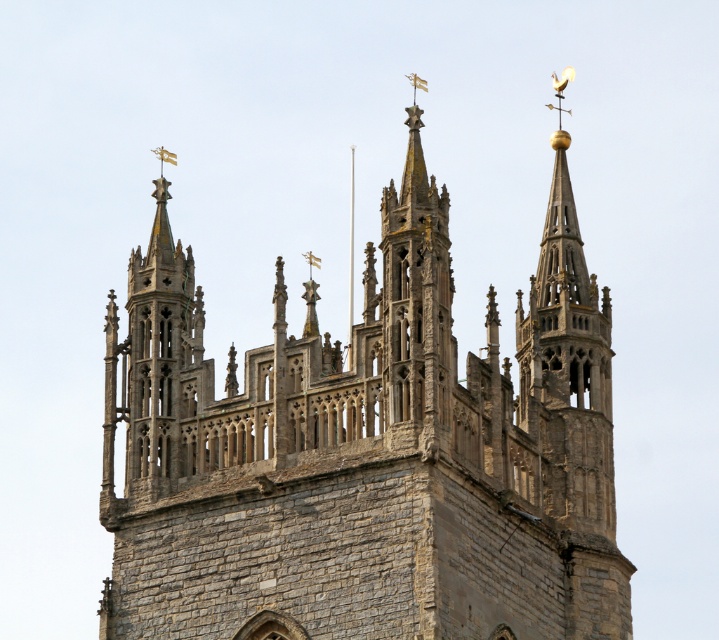
Can you confirm if gray stone church at center is smaller than gold polished spire at upper center?

Actually, gray stone church at center might be larger than gold polished spire at upper center.

In the scene shown: Who is more distant from viewer, (582, 276) or (522, 492)?

The point (582, 276) is behind.

Locate an element on the screen. This screenshot has height=640, width=719. gray stone church at center is located at coordinates (367, 451).

Does gold polished spire at upper center appear on the right side of stone spire at upper left?

Indeed, gold polished spire at upper center is positioned on the right side of stone spire at upper left.

In the scene shown: Measure the distance from gold polished spire at upper center to stone spire at upper left.

The distance of gold polished spire at upper center from stone spire at upper left is 36.58 feet.

Where is `gold polished spire at upper center`? The image size is (719, 640). gold polished spire at upper center is located at coordinates click(567, 364).

Does gray stone church at center appear on the right side of stone spire at upper left?

Indeed, gray stone church at center is positioned on the right side of stone spire at upper left.

Is point (109, 364) behind point (173, 356)?

Yes, it is behind point (173, 356).

Where is `gray stone church at center`? Image resolution: width=719 pixels, height=640 pixels. gray stone church at center is located at coordinates (367, 451).